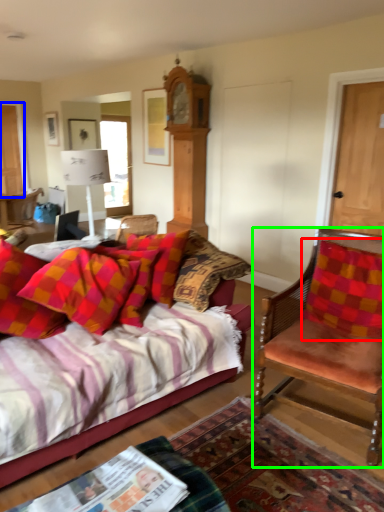
Question: Estimate the real-world distances between objects in this image. Which object is closer to pillow (highlighted by a red box), door (highlighted by a blue box) or chair (highlighted by a green box)?

Choices:
 (A) door
 (B) chair

Answer: (B)